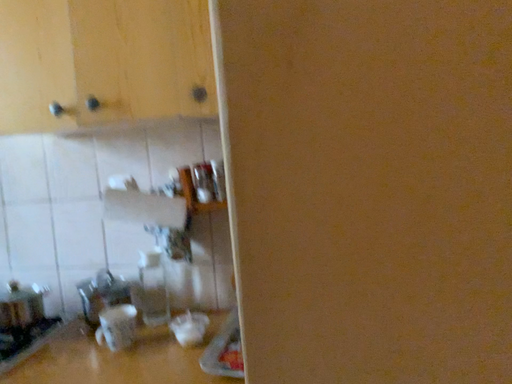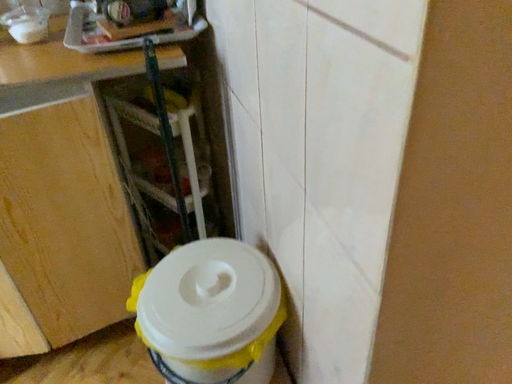
Question: Which way did the camera rotate in the video?

Choices:
 (A) rotated left
 (B) rotated right

Answer: (B)